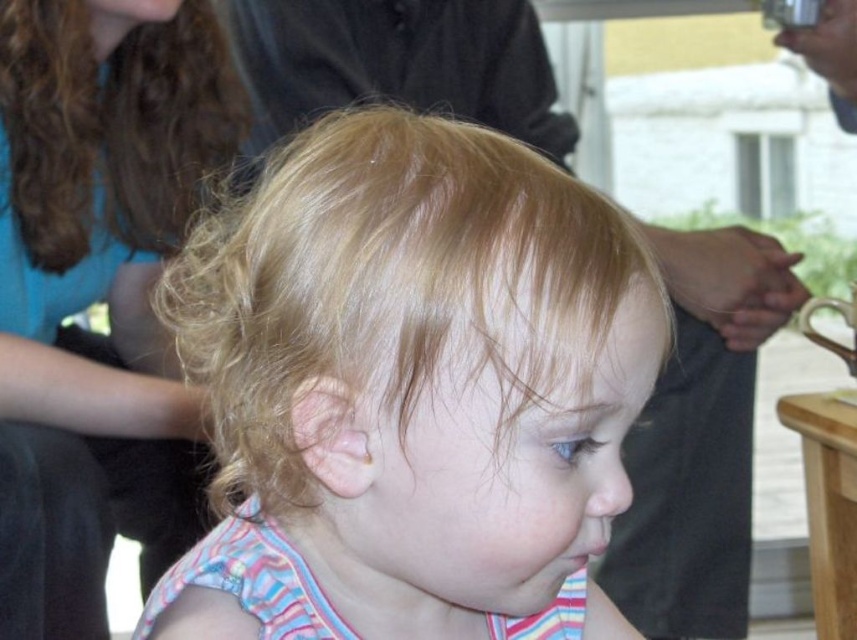
You are a photographer at an event and notice the blonde hair at center and curly brown hair at upper left in your viewfinder. Which hairstyle is closer to the camera?

The blonde hair at center is closer to the camera because it is in front of the curly brown hair at upper left.

Based on the scene description, where is the blonde hair at center in relation to the curly brown hair at upper left?

The blonde hair at center is below the curly brown hair at upper left.

In the image, there are two instances of blonde hair at center and blonde hair at upper left. Which one is larger in size?

The blonde hair at center is bigger than the blonde hair at upper left.